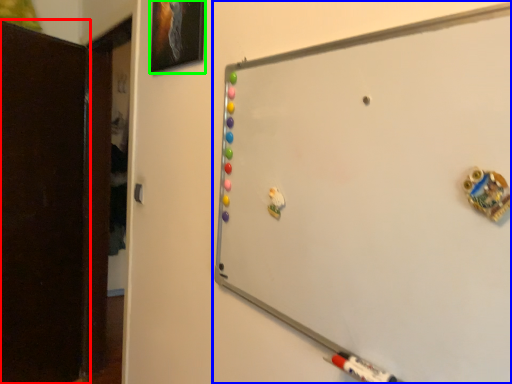
Question: Estimate the real-world distances between objects in this image. Which object is farther from door (highlighted by a red box), whiteboard (highlighted by a blue box) or picture frame (highlighted by a green box)?

Choices:
 (A) whiteboard
 (B) picture frame

Answer: (A)